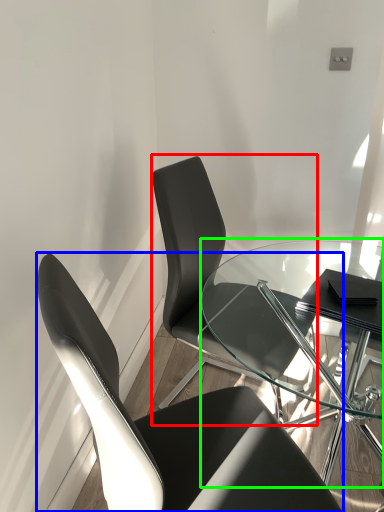
Question: Which is nearer to the chair (highlighted by a red box)? chair (highlighted by a blue box) or table (highlighted by a green box).

Choices:
 (A) chair
 (B) table

Answer: (B)